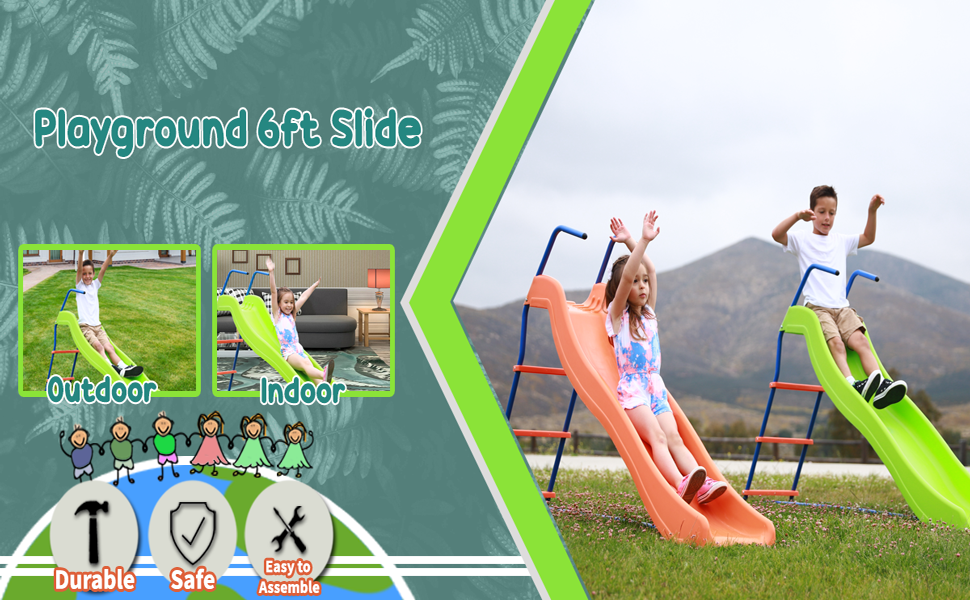
You are a GUI agent. You are given a task and a screenshot of the screen. Output one action in this format:
    pyautogui.click(x=<x>, y=<y>)
    Task: Click on the slide ladder rung
    The height and width of the screenshot is (600, 970).
    Given the screenshot: What is the action you would take?
    pyautogui.click(x=63, y=378), pyautogui.click(x=65, y=352), pyautogui.click(x=228, y=371), pyautogui.click(x=221, y=342), pyautogui.click(x=542, y=493), pyautogui.click(x=532, y=432), pyautogui.click(x=539, y=371), pyautogui.click(x=764, y=492), pyautogui.click(x=784, y=445), pyautogui.click(x=796, y=388)